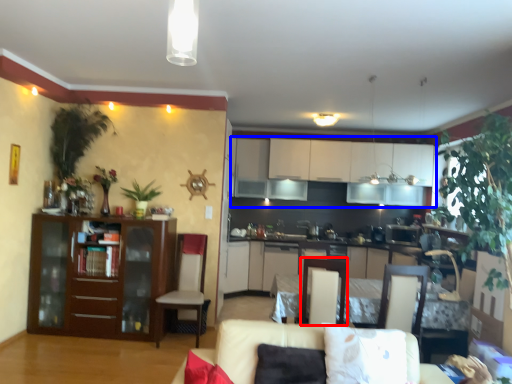
Question: Which point is further to the camera, armchair (highlighted by a red box) or cabinetry (highlighted by a blue box)?

Choices:
 (A) armchair
 (B) cabinetry

Answer: (B)